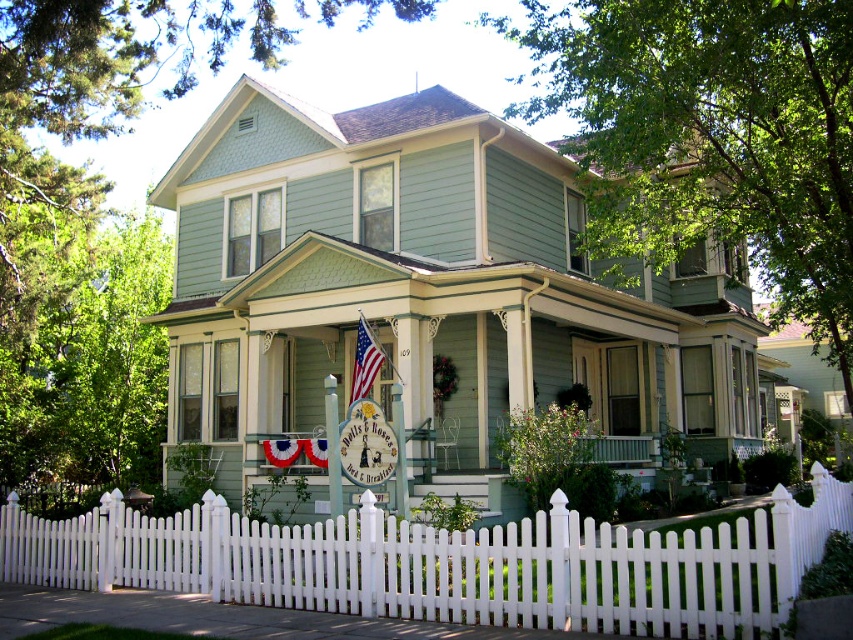
Between white picket fence at lower center and american flag at center, which one has more height?

white picket fence at lower center is taller.

Can you confirm if white picket fence at lower center is positioned above american flag at center?

No, white picket fence at lower center is not above american flag at center.

Locate an element on the screen. white picket fence at lower center is located at coordinates (448, 563).

Find the location of a particular element. This screenshot has height=640, width=853. white picket fence at lower center is located at coordinates (448, 563).